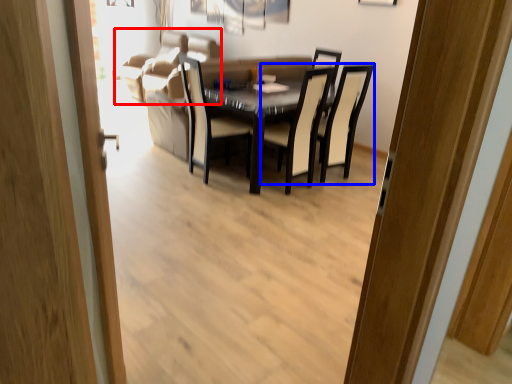
Question: Which point is further to the camera, couch (highlighted by a red box) or chair (highlighted by a blue box)?

Choices:
 (A) couch
 (B) chair

Answer: (A)